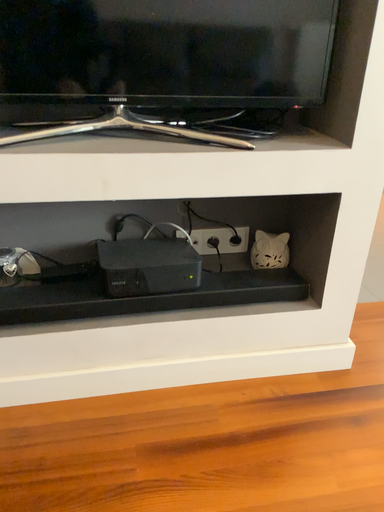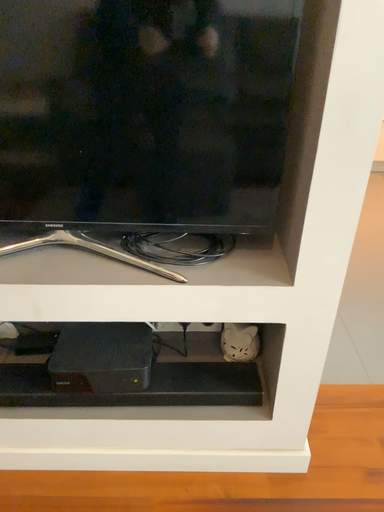
Question: How did the camera likely rotate when shooting the video?

Choices:
 (A) rotated left
 (B) rotated right

Answer: (A)